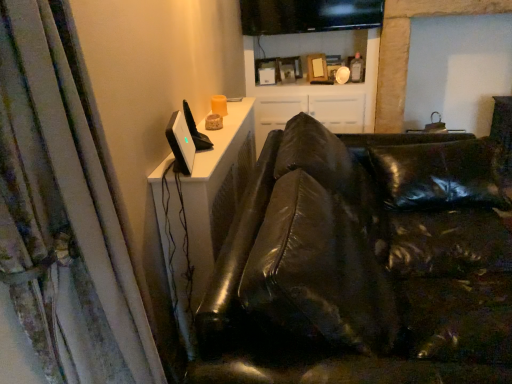
Question: Is satin black monitor at upper left, the first computer monitor when ordered from left to right, bigger or smaller than black glossy monitor at upper center, which is the first computer monitor from back to front?

Choices:
 (A) big
 (B) small

Answer: (B)

Question: Considering the positions of satin black monitor at upper left, arranged as the 1th computer monitor when ordered from the bottom, and black glossy monitor at upper center, the first computer monitor positioned from the right, in the image, is satin black monitor at upper left, arranged as the 1th computer monitor when ordered from the bottom, wider or thinner than black glossy monitor at upper center, the first computer monitor positioned from the right,?

Choices:
 (A) thin
 (B) wide

Answer: (A)

Question: Estimate the real-world distances between objects in this image. Which object is farther from the white glossy cabinet at upper center?

Choices:
 (A) white textured curtain at left
 (B) satin black monitor at upper left, positioned as the second computer monitor in right-to-left order
 (C) black leather couch at center
 (D) black glossy monitor at upper center, the first computer monitor positioned from the right

Answer: (A)

Question: Which is nearer to the satin black monitor at upper left, arranged as the 1th computer monitor when ordered from the bottom?

Choices:
 (A) black glossy monitor at upper center, the second computer monitor positioned from the front
 (B) white textured curtain at left
 (C) black leather couch at center
 (D) white glossy cabinet at upper center

Answer: (B)